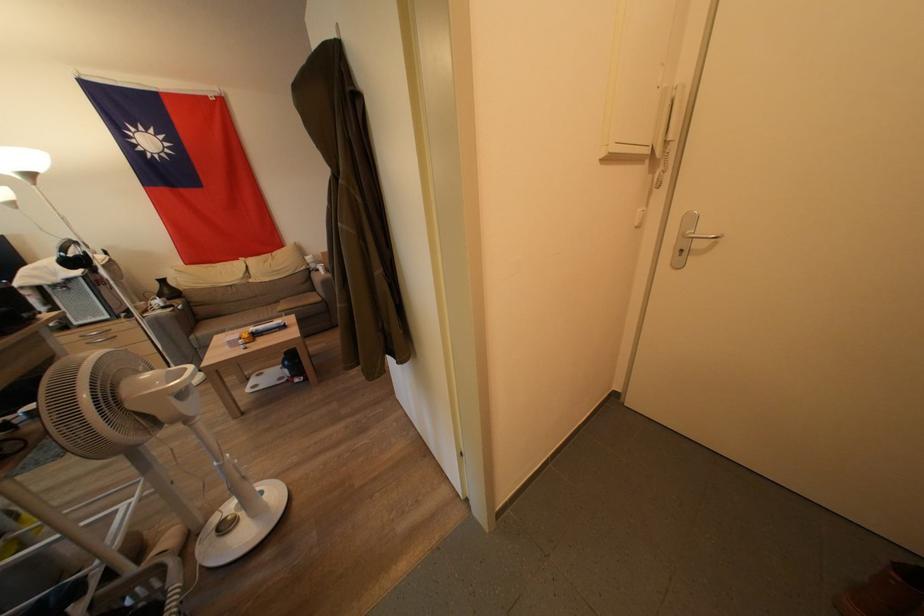
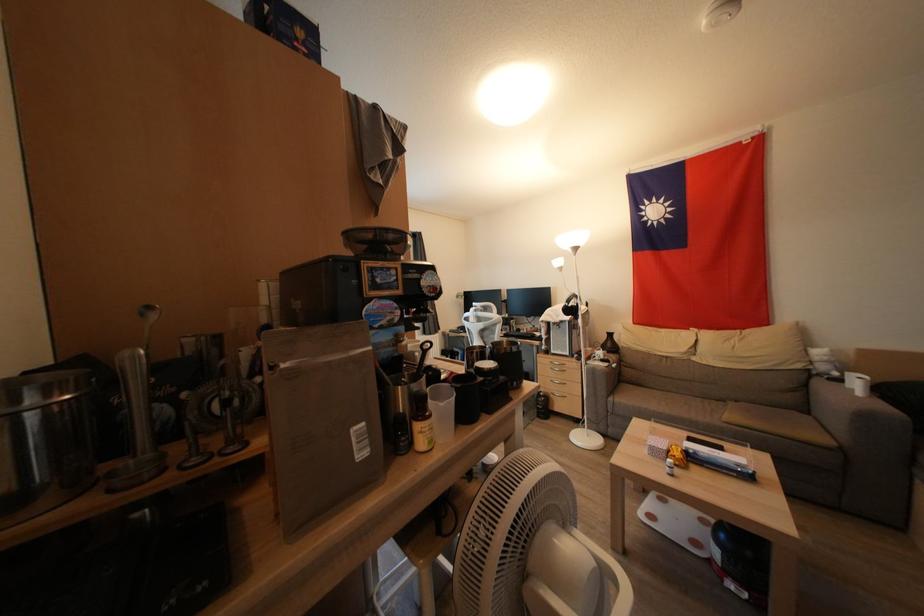
Question: The first image is from the beginning of the video and the second image is from the end. How did the camera likely rotate when shooting the video?

Choices:
 (A) Left
 (B) Right
 (C) Up
 (D) Down

Answer: (A)